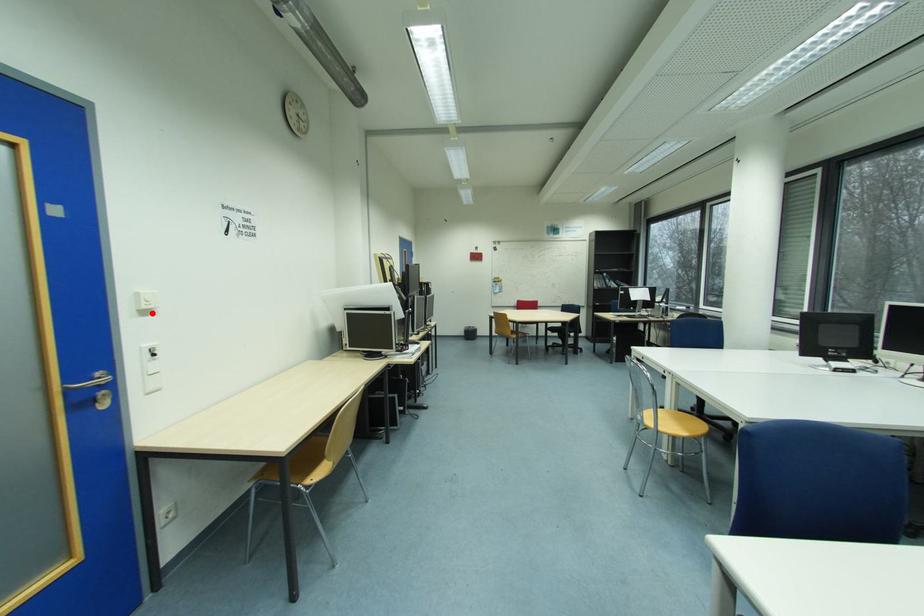
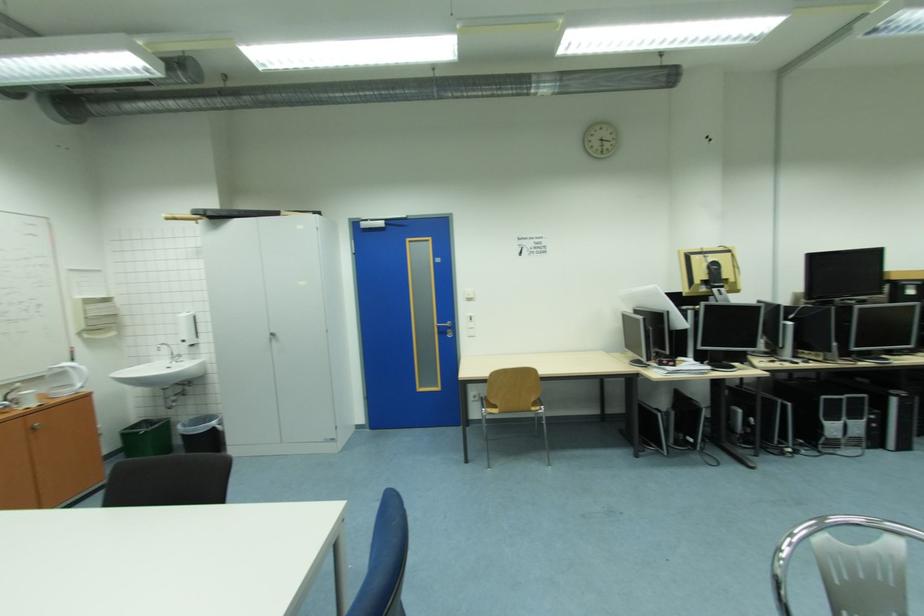
The point at the highlighted location is marked in the first image. Where is the corresponding point in the second image?

(477, 301)